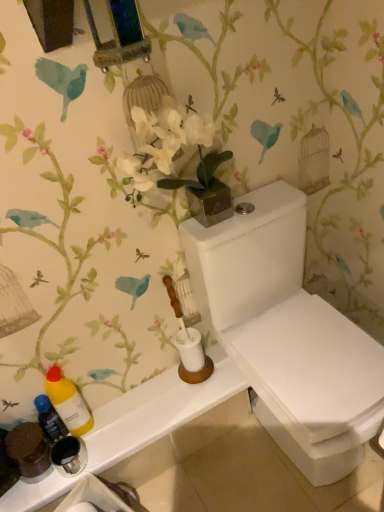
Locate an element on the screen. Image resolution: width=384 pixels, height=512 pixels. free space in front of yellow matte bottle at lower left, the 1th bottle from the right is located at coordinates (82, 462).